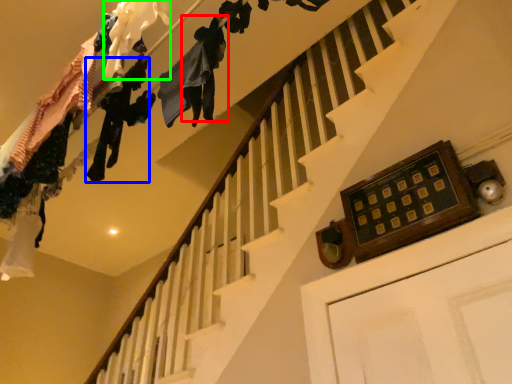
Question: Which is nearer to the clothing (highlighted by a red box)? clothing (highlighted by a blue box) or clothing (highlighted by a green box).

Choices:
 (A) clothing
 (B) clothing

Answer: (B)